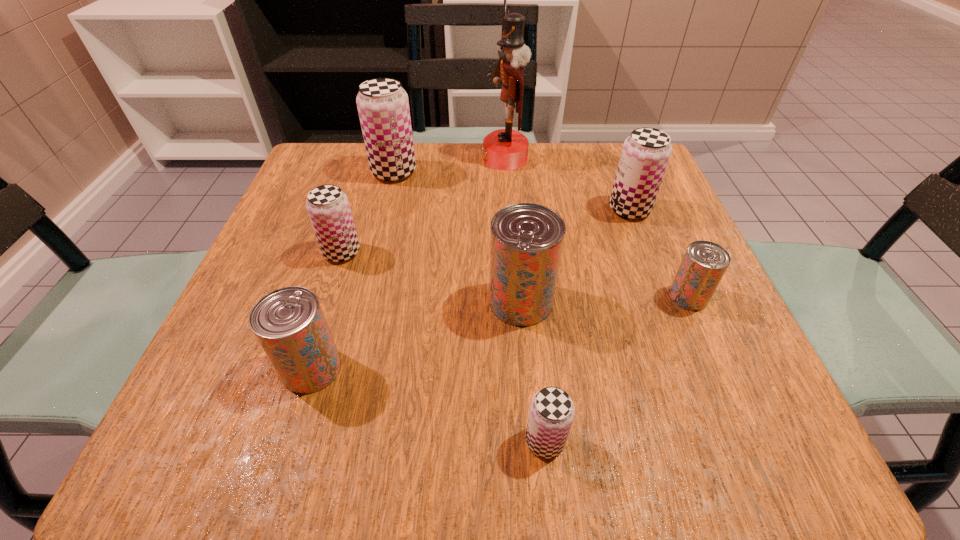
Image resolution: width=960 pixels, height=540 pixels. I want to click on vacant region that satisfies the following two spatial constraints: 1. on the back side of the second tallest object; 2. on the right side of the second nearest object, so click(x=372, y=172).

At what (x,y) coordinates should I click in order to perform the action: click on vacant space that satisfies the following two spatial constraints: 1. on the front-facing side of the tallest object; 2. on the back side of the rightmost red beer can. Please return your answer as a coordinate pair (x, y). The width and height of the screenshot is (960, 540). Looking at the image, I should click on coord(516,296).

The image size is (960, 540). Find the location of `free point that satisfies the following two spatial constraints: 1. on the front-facing side of the nutcracker; 2. on the right side of the second biggest purple beer can`. free point that satisfies the following two spatial constraints: 1. on the front-facing side of the nutcracker; 2. on the right side of the second biggest purple beer can is located at coordinates (509, 210).

Image resolution: width=960 pixels, height=540 pixels. Identify the location of free space that satisfies the following two spatial constraints: 1. on the front-facing side of the tallest object; 2. on the left side of the third farthest object. (509, 210).

Identify the location of blank area in the image that satisfies the following two spatial constraints: 1. on the front side of the nearest purple beer can; 2. on the right side of the leftmost red beer can. Image resolution: width=960 pixels, height=540 pixels. click(290, 441).

At what (x,y) coordinates should I click in order to perform the action: click on free spot that satisfies the following two spatial constraints: 1. on the front-facing side of the tallest object; 2. on the right side of the second red beer can from left to right. Please return your answer as a coordinate pair (x, y). The image size is (960, 540). Looking at the image, I should click on (516, 301).

This screenshot has height=540, width=960. I want to click on free space that satisfies the following two spatial constraints: 1. on the back side of the second purple beer can from right to left; 2. on the left side of the third farthest object, so click(x=520, y=210).